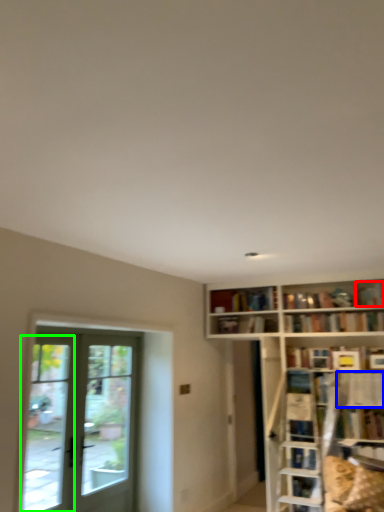
Question: Based on their relative distances, which object is farther from book (highlighted by a red box)? Choose from shelf (highlighted by a blue box) and window (highlighted by a green box).

Choices:
 (A) shelf
 (B) window

Answer: (B)